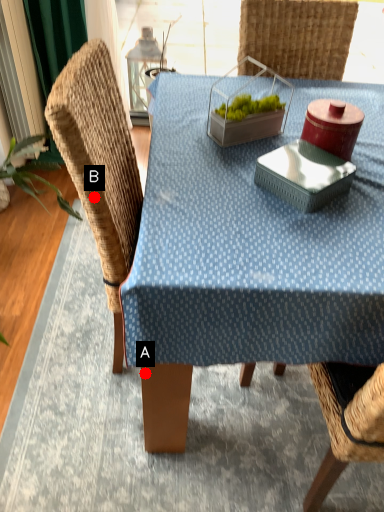
Question: Two points are circled on the image, labeled by A and B beside each circle. Among these points, which one is nearest to the camera?

Choices:
 (A) A is closer
 (B) B is closer

Answer: (B)